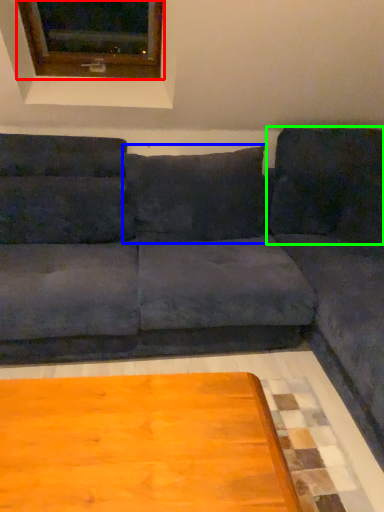
Question: Estimate the real-world distances between objects in this image. Which object is closer to window (highlighted by a red box), pillow (highlighted by a blue box) or pillow (highlighted by a green box)?

Choices:
 (A) pillow
 (B) pillow

Answer: (A)